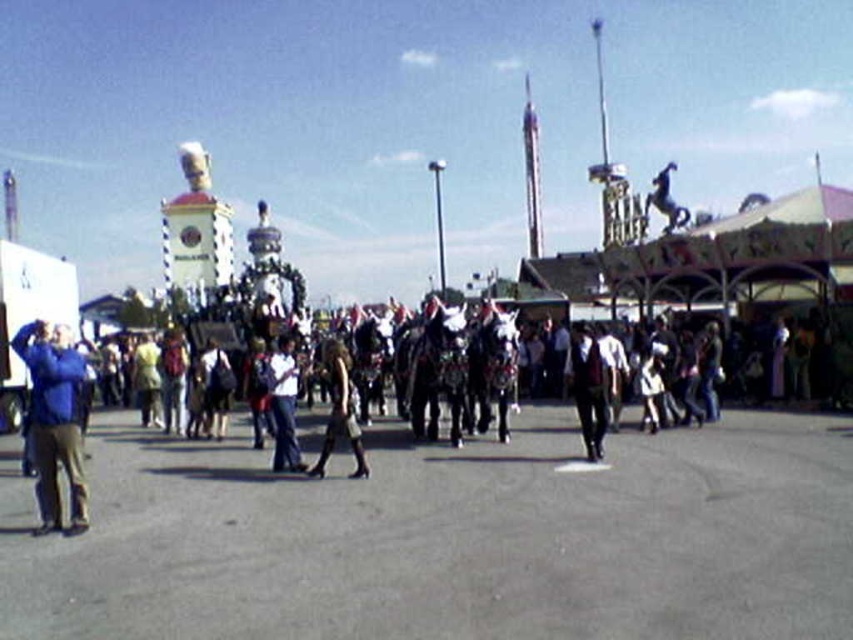
Question: Can you confirm if black leather boots at center is positioned to the right of white cotton shirt at center?

Choices:
 (A) no
 (B) yes

Answer: (B)

Question: Is blue fabric jacket at left wider than black leather boots at center?

Choices:
 (A) no
 (B) yes

Answer: (B)

Question: Can you confirm if blue fabric jacket at left is wider than white cotton shirt at center?

Choices:
 (A) no
 (B) yes

Answer: (B)

Question: Which of the following is the closest to the observer?

Choices:
 (A) white cotton shirt at center
 (B) blue fabric jacket at left

Answer: (B)

Question: Which of the following is the farthest from the observer?

Choices:
 (A) (274, 392)
 (B) (354, 477)
 (C) (79, 440)

Answer: (A)

Question: Which object appears farthest from the camera in this image?

Choices:
 (A) black leather boots at center
 (B) blue fabric jacket at left
 (C) white cotton shirt at center

Answer: (C)